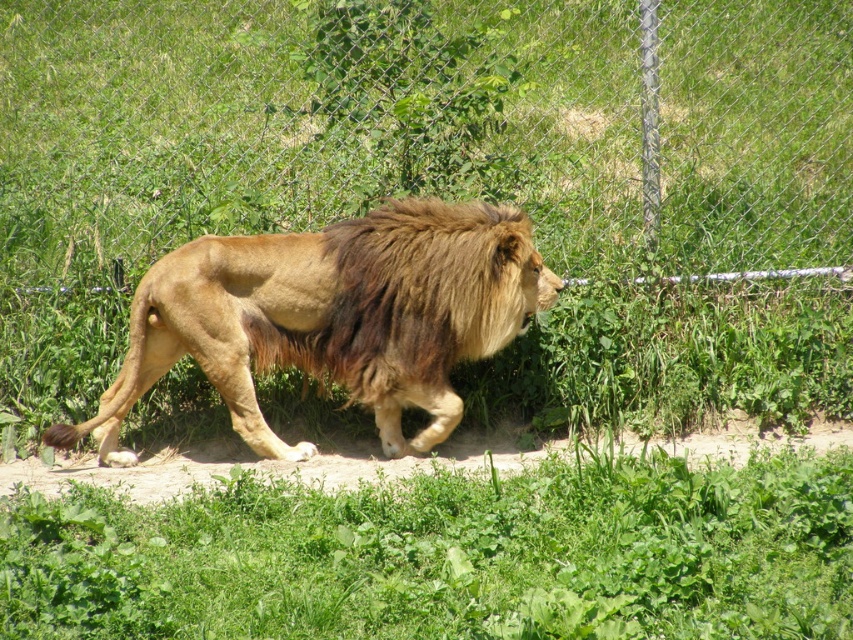
Question: Considering the real-world distances, which object is closest to the golden fur lion at center?

Choices:
 (A) brown fuzzy mane at center
 (B) green leafy grass at lower center

Answer: (A)

Question: Considering the real-world distances, which object is farthest from the golden fur lion at center?

Choices:
 (A) green leafy grass at lower center
 (B) metallic chain-link fence at center
 (C) brown fuzzy mane at center

Answer: (B)

Question: Among these objects, which one is farthest from the camera?

Choices:
 (A) golden fur lion at center
 (B) brown fuzzy mane at center

Answer: (A)

Question: Is golden fur lion at center smaller than brown fuzzy mane at center?

Choices:
 (A) yes
 (B) no

Answer: (B)

Question: Is green leafy grass at lower center to the right of golden fur lion at center from the viewer's perspective?

Choices:
 (A) no
 (B) yes

Answer: (B)

Question: Can you confirm if metallic chain-link fence at center is bigger than green leafy grass at lower center?

Choices:
 (A) no
 (B) yes

Answer: (A)